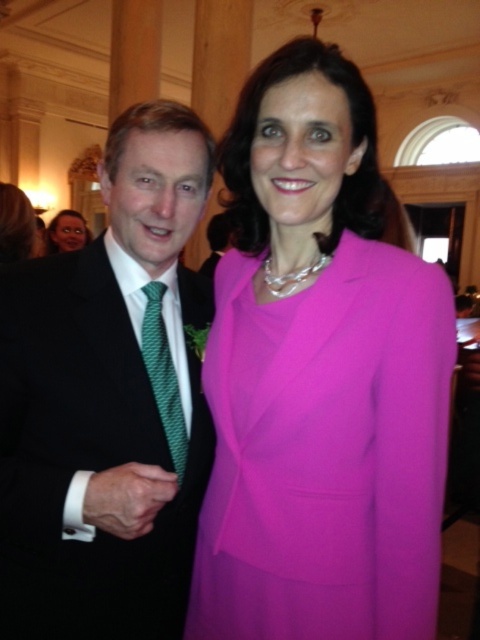
You are an event planner setting up a photo shoot in the described scene. You need to position a spotlight at coordinates point A, which is at the center of the image. The spotlight has a narrow beam that can only illuminate objects within a 0.1 unit radius. Will the matte black suit at left be illuminated by the spotlight?

The matte black suit at left is located at point A, which is at the center of the image. Since the spotlight is placed at the center with a 0.1 unit radius, and the suit is exactly at point A, it will be illuminated by the spotlight.